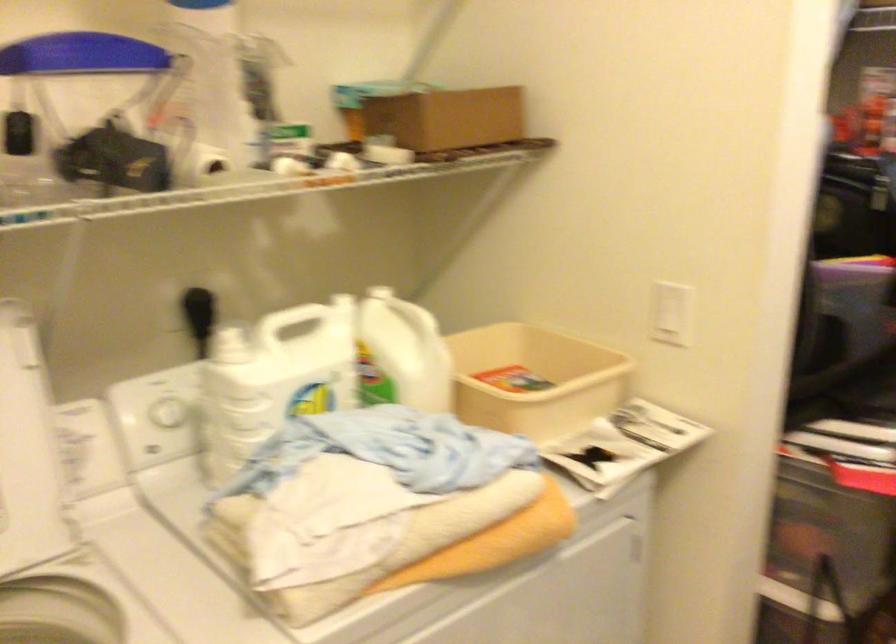
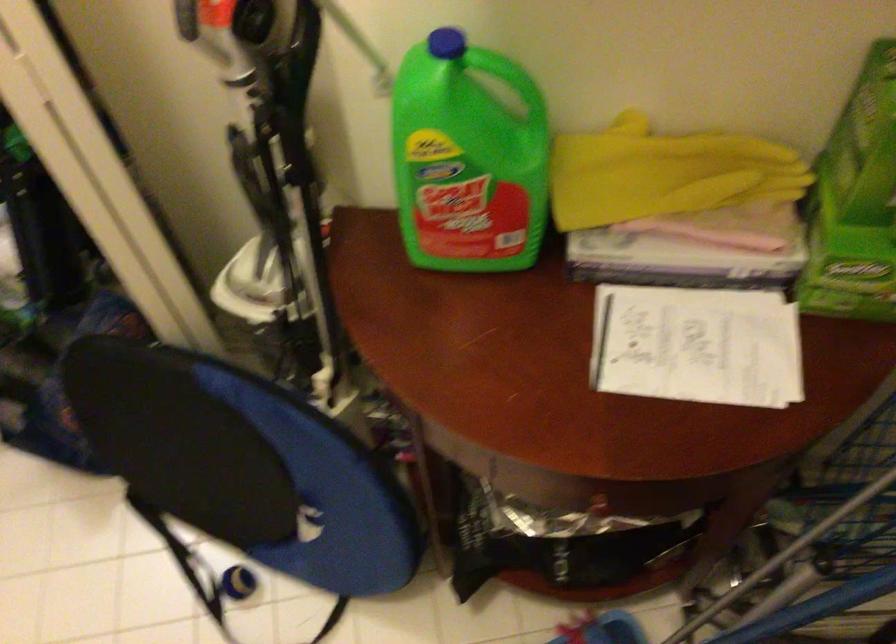
First-person continuous shooting, in which direction is the camera rotating?

The camera rotated toward right-down.